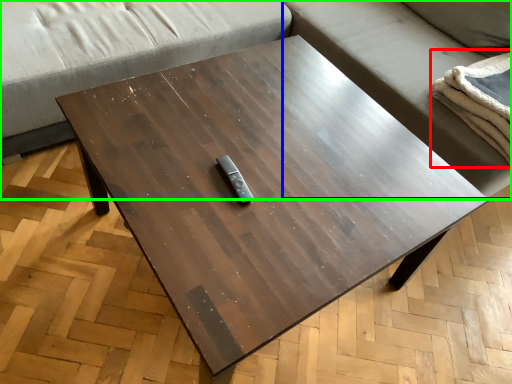
Question: Which object is positioned farthest from blanket (highlighted by a red box)? Select from couch (highlighted by a blue box) and studio couch (highlighted by a green box).

Choices:
 (A) couch
 (B) studio couch

Answer: (B)